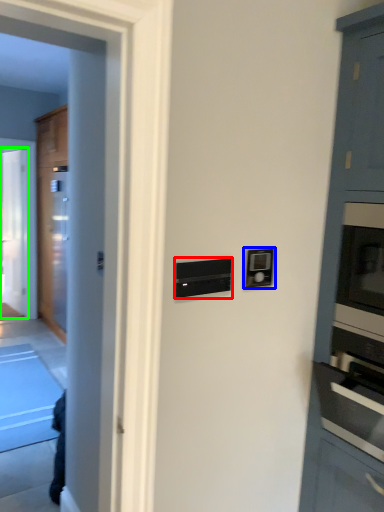
Question: Based on their relative distances, which object is farther from appliance (highlighted by a red box)? Choose from light switch (highlighted by a blue box) and glass door (highlighted by a green box).

Choices:
 (A) light switch
 (B) glass door

Answer: (B)